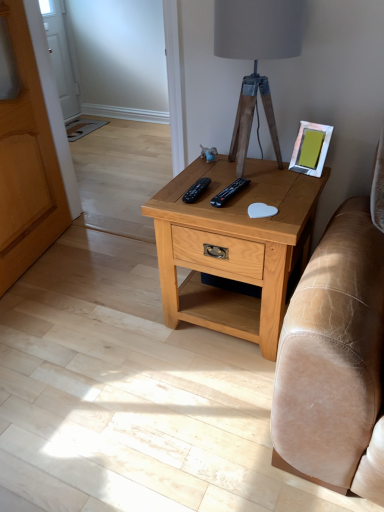
Identify the location of vacant space that is in between light brown wood nightstand at center and wooden armoire at left. This screenshot has width=384, height=512. (104, 279).